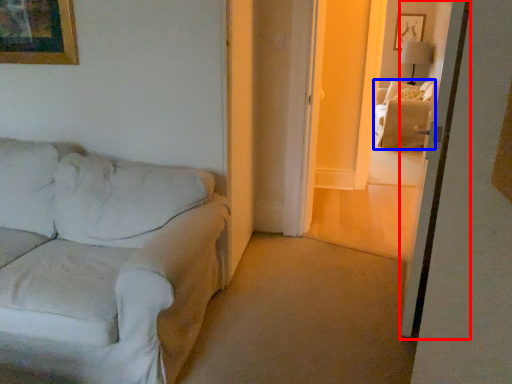
Question: Which object is closer to the camera taking this photo, screen door (highlighted by a red box) or couch (highlighted by a blue box)?

Choices:
 (A) screen door
 (B) couch

Answer: (A)